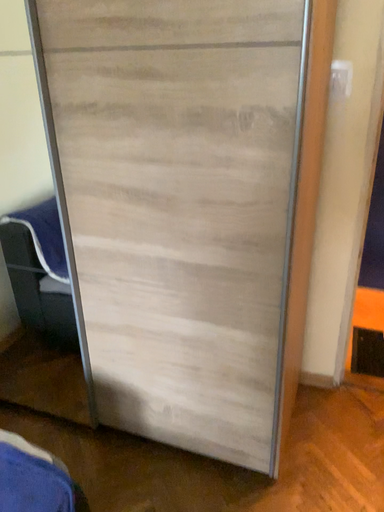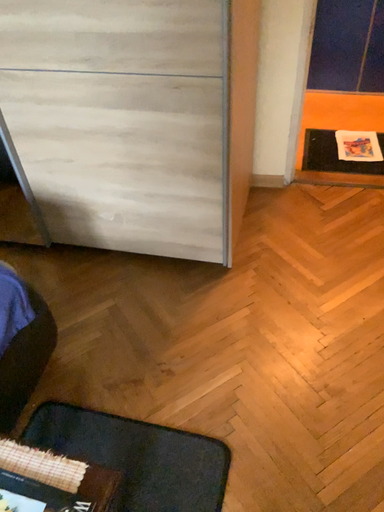
Question: How did the camera likely rotate when shooting the video?

Choices:
 (A) rotated upward
 (B) rotated downward

Answer: (B)